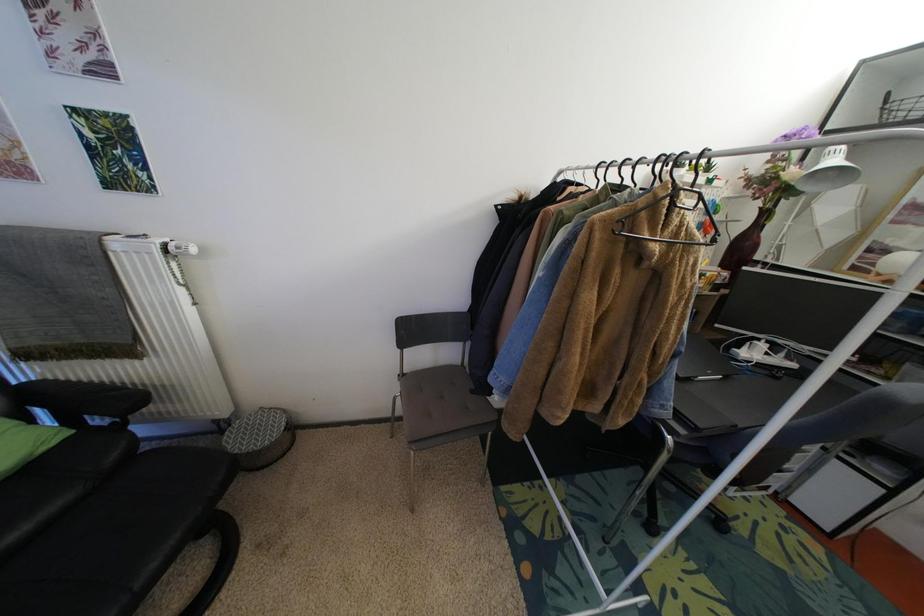
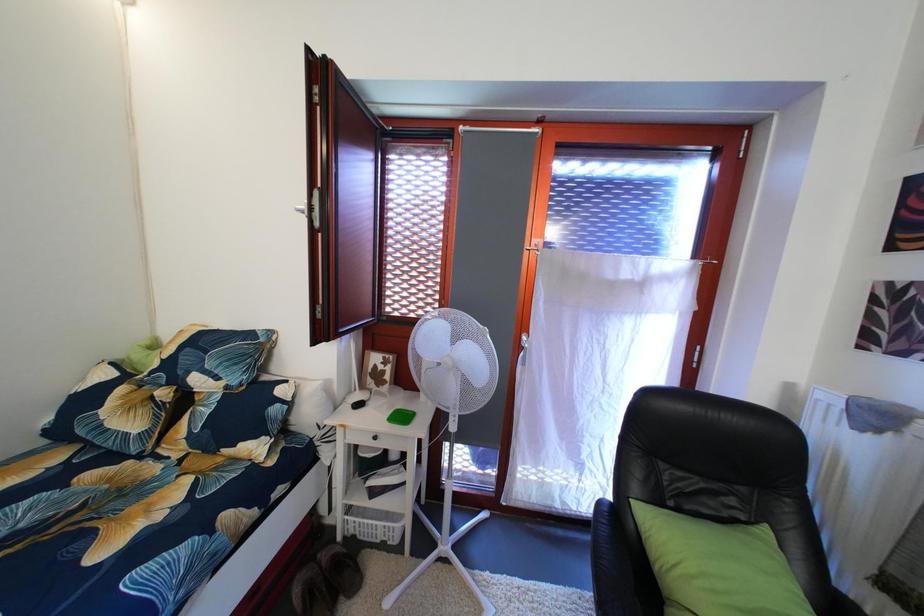
Question: The first image is from the beginning of the video and the second image is from the end. How did the camera likely rotate when shooting the video?

Choices:
 (A) Left
 (B) Right
 (C) Up
 (D) Down

Answer: (A)